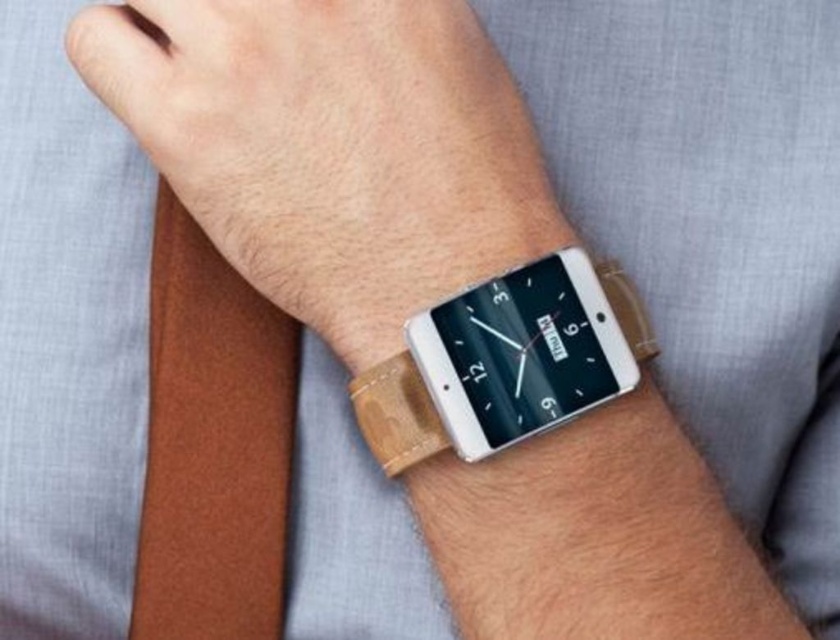
You are a fashion designer observing the image. You want to ensure that the leather watch at center and the leather strap at wrist are visible in a promotional photo. Based on their current positions, which one is more likely to be seen by the camera?

The leather watch at center is more likely to be seen by the camera because it is in front of the leather strap at wrist.